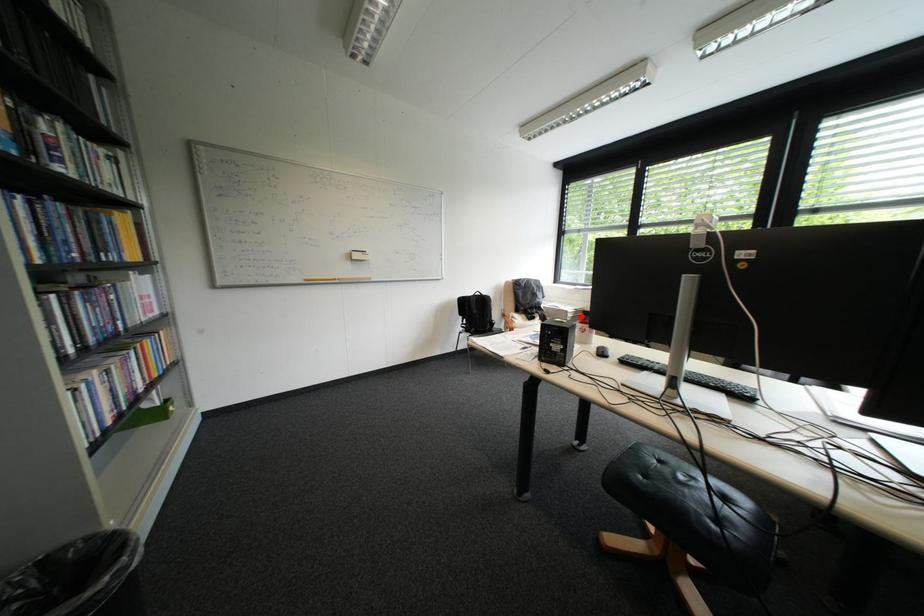
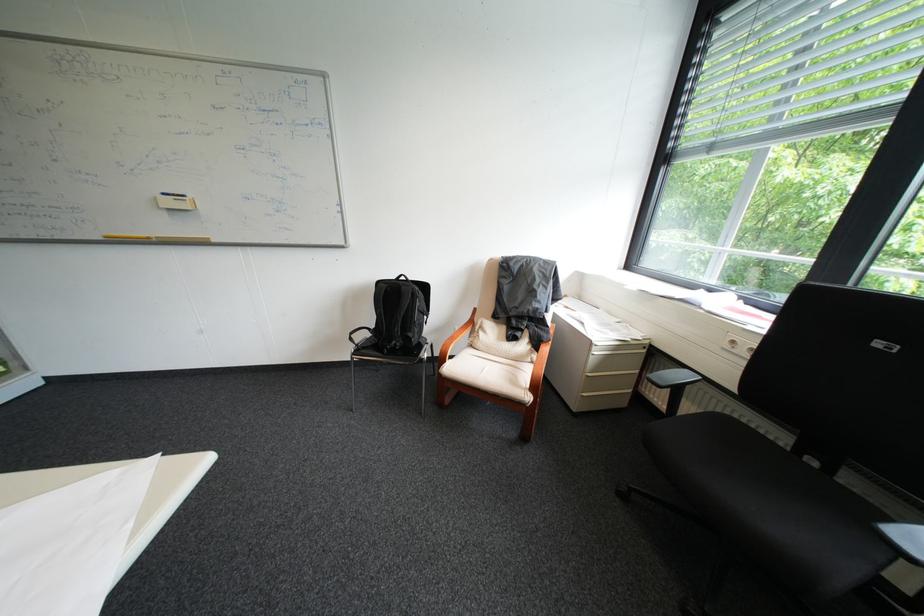
Question: I am providing you with two images of the same scene from different viewpoints. A red point is shown in image1. For the corresponding object point in image2, is it positioned nearer or farther from the camera?

Choices:
 (A) Nearer
 (B) Farther

Answer: (B)